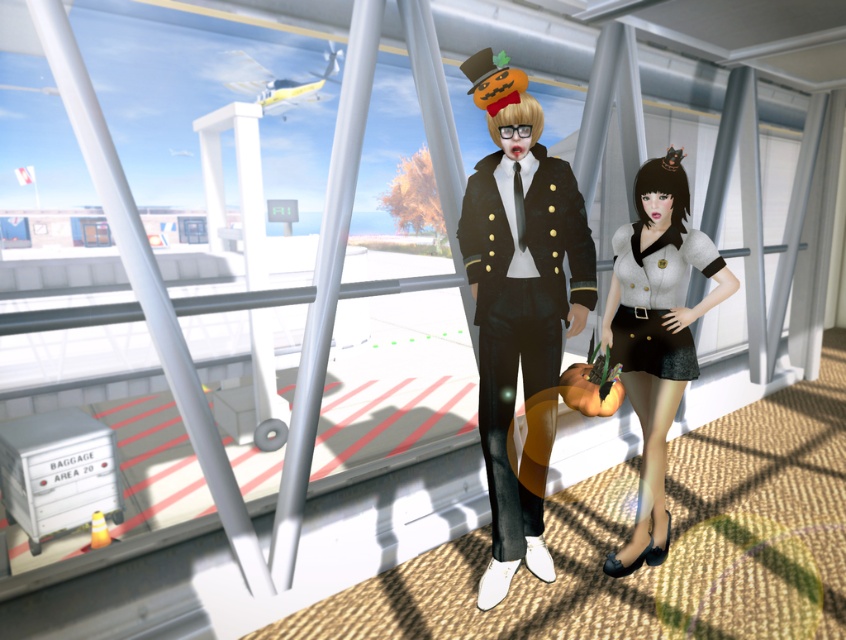
Question: Among these points, which one is farthest from the camera?

Choices:
 (A) (487, 422)
 (B) (640, 513)

Answer: (B)

Question: Estimate the real-world distances between objects in this image. Which object is farther from the shiny black uniform at center?

Choices:
 (A) white woolen dress at center
 (B) matte gray shirt at center

Answer: (B)

Question: Which object is the closest to the matte gray shirt at center?

Choices:
 (A) shiny black uniform at center
 (B) white woolen dress at center

Answer: (B)

Question: Does shiny black uniform at center have a smaller size compared to matte gray shirt at center?

Choices:
 (A) yes
 (B) no

Answer: (A)

Question: Where is matte gray shirt at center located in relation to white woolen dress at center in the image?

Choices:
 (A) above
 (B) below

Answer: (B)

Question: Can you confirm if shiny black uniform at center is positioned below matte gray shirt at center?

Choices:
 (A) no
 (B) yes

Answer: (A)